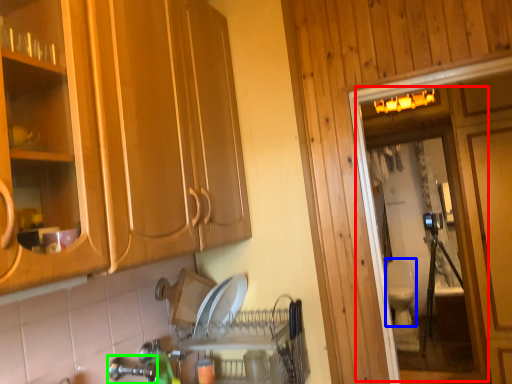
Question: Which object is the farthest from screen door (highlighted by a red box)? Choose among these: toilet bowl (highlighted by a blue box) or faucet (highlighted by a green box).

Choices:
 (A) toilet bowl
 (B) faucet

Answer: (B)